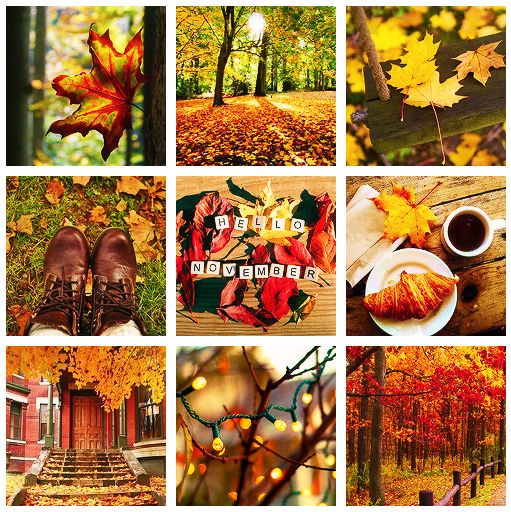
You are a GUI agent. You are given a task and a screenshot of the screen. Output one action in this format:
    pyautogui.click(x=<x>, y=<y>)
    Task: Click on the boxes
    This screenshot has width=511, height=512.
    Given the screenshot: What is the action you would take?
    pyautogui.click(x=441, y=448), pyautogui.click(x=263, y=429), pyautogui.click(x=82, y=435), pyautogui.click(x=419, y=298), pyautogui.click(x=263, y=262), pyautogui.click(x=92, y=261), pyautogui.click(x=98, y=102), pyautogui.click(x=243, y=120), pyautogui.click(x=410, y=98)